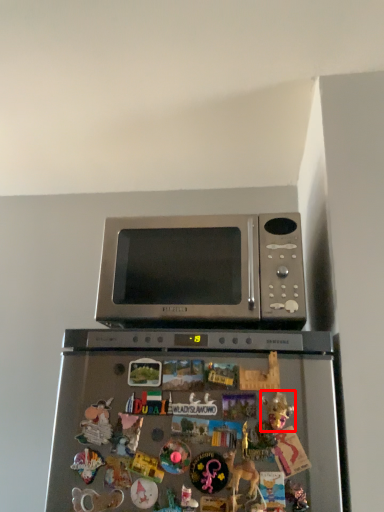
Question: From the image's perspective, what is the correct spatial positioning of toy (annotated by the red box) in reference to microwave oven?

Choices:
 (A) below
 (B) above

Answer: (A)